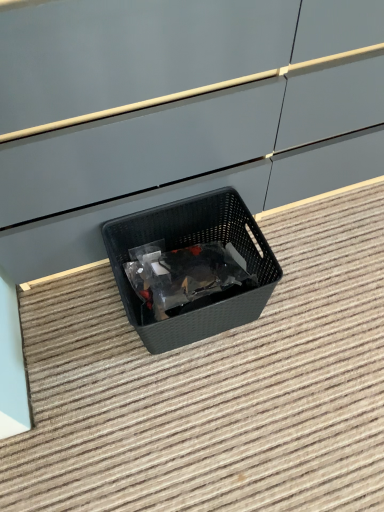
Find the location of `free location to the left of black plastic basket at center`. free location to the left of black plastic basket at center is located at coordinates (74, 329).